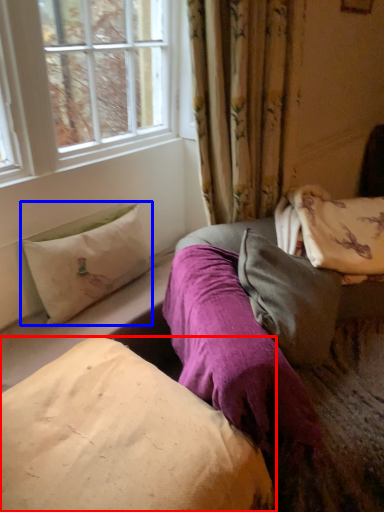
Question: Which point is closer to the camera, pillow (highlighted by a red box) or pillow (highlighted by a blue box)?

Choices:
 (A) pillow
 (B) pillow

Answer: (A)